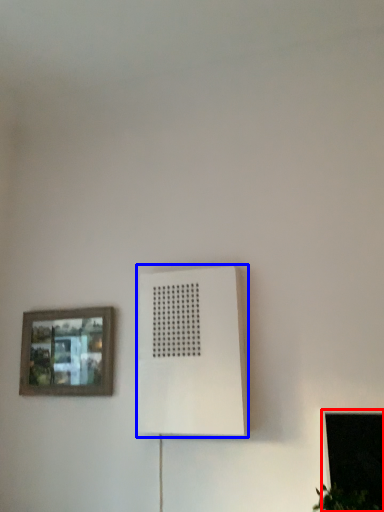
Question: Which object is further to the camera taking this photo, window (highlighted by a red box) or air conditioning (highlighted by a blue box)?

Choices:
 (A) window
 (B) air conditioning

Answer: (B)